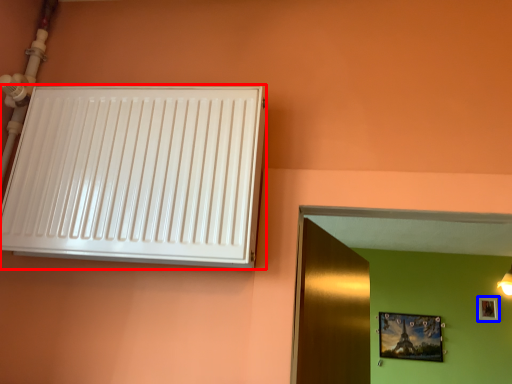
Question: Which point is further to the camera, air conditioning (highlighted by a red box) or picture frame (highlighted by a blue box)?

Choices:
 (A) air conditioning
 (B) picture frame

Answer: (B)